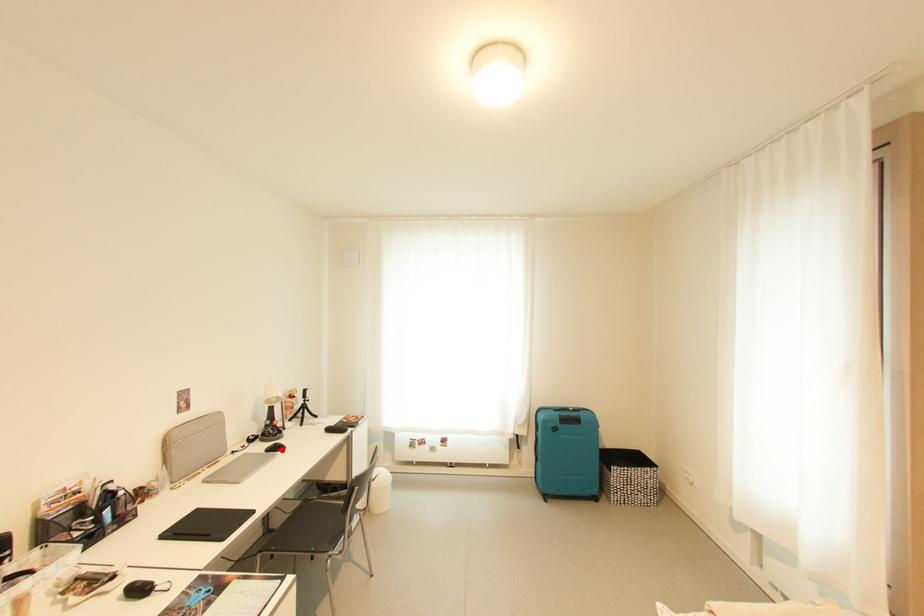
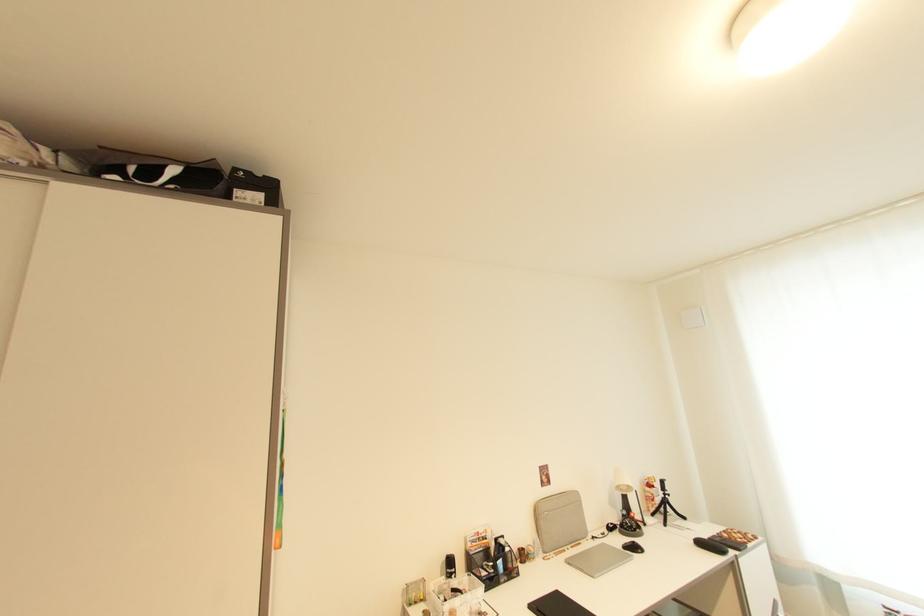
In the second image, find the point that corresponds to the highlighted location in the first image.

(639, 549)